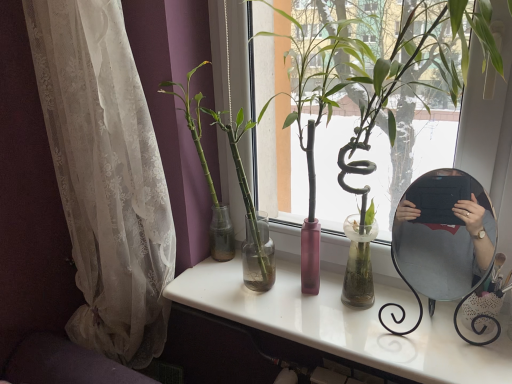
What are the coordinates of `free spot behind metallic silver mirror at right` in the screenshot? It's located at (413, 306).